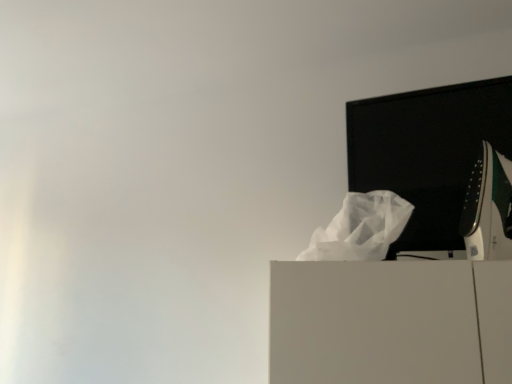
Measure the distance between point (460, 162) and camera.

Point (460, 162) and camera are 1.12 meters apart.

Find the location of `black glossy computer monitor at upper right`. black glossy computer monitor at upper right is located at coordinates (426, 149).

Measure the distance between black glossy computer monitor at upper right and camera.

The depth of black glossy computer monitor at upper right is 1.05 meters.

The height and width of the screenshot is (384, 512). What do you see at coordinates (426, 149) in the screenshot?
I see `black glossy computer monitor at upper right` at bounding box center [426, 149].

The image size is (512, 384). Identify the location of black glossy computer monitor at upper right. (426, 149).